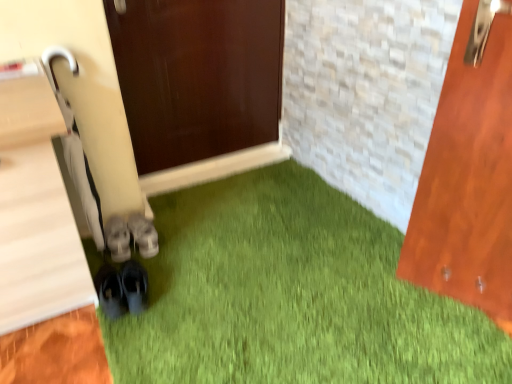
Question: Which direction should I rotate to look at gray suede shoes at center, arranged as the third footwear when viewed from the front, — up or down?

Choices:
 (A) up
 (B) down

Answer: (B)

Question: Is black matte shoes at lower left, marked as the third footwear in a back-to-front arrangement, taller than white leather sneakers at center, the 2th footwear from the front?

Choices:
 (A) yes
 (B) no

Answer: (A)

Question: Does black matte shoes at lower left, the first footwear viewed from the front, have a greater width compared to white leather sneakers at center, the 2th footwear viewed from the back?

Choices:
 (A) yes
 (B) no

Answer: (A)

Question: Is black matte shoes at lower left, marked as the third footwear in a back-to-front arrangement, facing away from white leather sneakers at center, the 2th footwear from the front?

Choices:
 (A) no
 (B) yes

Answer: (A)

Question: From the image's perspective, is black matte shoes at lower left, marked as the third footwear in a back-to-front arrangement, under white leather sneakers at center, the 2th footwear viewed from the back?

Choices:
 (A) no
 (B) yes

Answer: (B)

Question: Is black matte shoes at lower left, the first footwear viewed from the front, at the right side of white leather sneakers at center, the 2th footwear viewed from the back?

Choices:
 (A) no
 (B) yes

Answer: (B)

Question: Is black matte shoes at lower left, marked as the third footwear in a back-to-front arrangement, further to camera compared to white leather sneakers at center, the 2th footwear from the front?

Choices:
 (A) yes
 (B) no

Answer: (B)

Question: Considering the relative sizes of gray suede shoes at center, which appears as the 1th footwear when viewed from the back, and white leather sneakers at center, the 2th footwear viewed from the back, in the image provided, is gray suede shoes at center, which appears as the 1th footwear when viewed from the back, thinner than white leather sneakers at center, the 2th footwear viewed from the back,?

Choices:
 (A) no
 (B) yes

Answer: (A)

Question: From the image's perspective, would you say gray suede shoes at center, arranged as the third footwear when viewed from the front, is positioned over white leather sneakers at center, the 2th footwear from the front?

Choices:
 (A) yes
 (B) no

Answer: (A)

Question: Can you confirm if gray suede shoes at center, arranged as the third footwear when viewed from the front, is bigger than white leather sneakers at center, the 2th footwear from the front?

Choices:
 (A) yes
 (B) no

Answer: (A)

Question: Considering the relative positions of gray suede shoes at center, arranged as the third footwear when viewed from the front, and white leather sneakers at center, the 2th footwear from the front, in the image provided, is gray suede shoes at center, arranged as the third footwear when viewed from the front, behind white leather sneakers at center, the 2th footwear from the front,?

Choices:
 (A) yes
 (B) no

Answer: (A)

Question: Considering the relative positions of gray suede shoes at center, which appears as the 1th footwear when viewed from the back, and white leather sneakers at center, the 2th footwear from the front, in the image provided, is gray suede shoes at center, which appears as the 1th footwear when viewed from the back, to the left of white leather sneakers at center, the 2th footwear from the front, from the viewer's perspective?

Choices:
 (A) yes
 (B) no

Answer: (B)

Question: From a real-world perspective, is gray suede shoes at center, which appears as the 1th footwear when viewed from the back, physically below white leather sneakers at center, the 2th footwear from the front?

Choices:
 (A) yes
 (B) no

Answer: (B)

Question: Is gray suede shoes at center, arranged as the third footwear when viewed from the front, taller than black matte shoes at lower left, the first footwear viewed from the front?

Choices:
 (A) yes
 (B) no

Answer: (B)